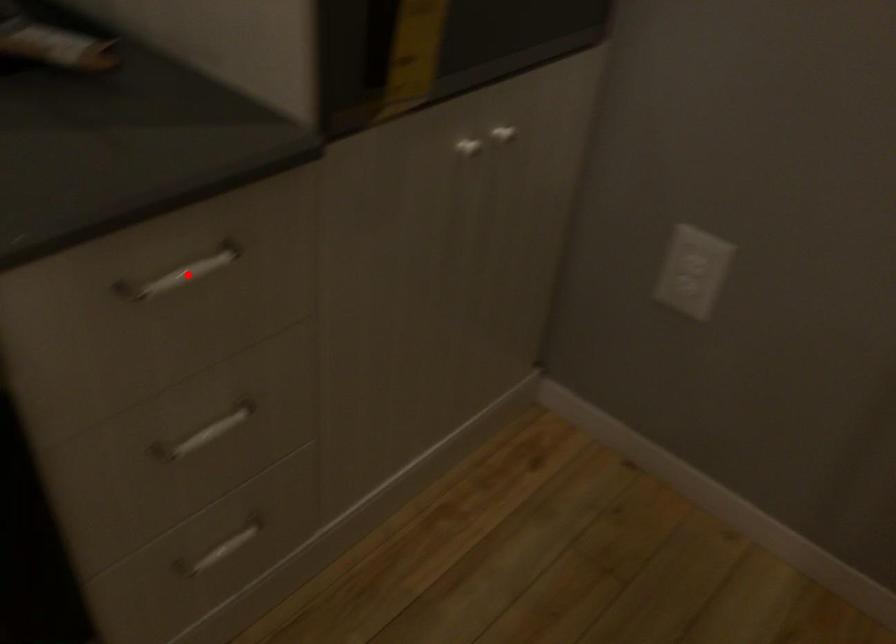
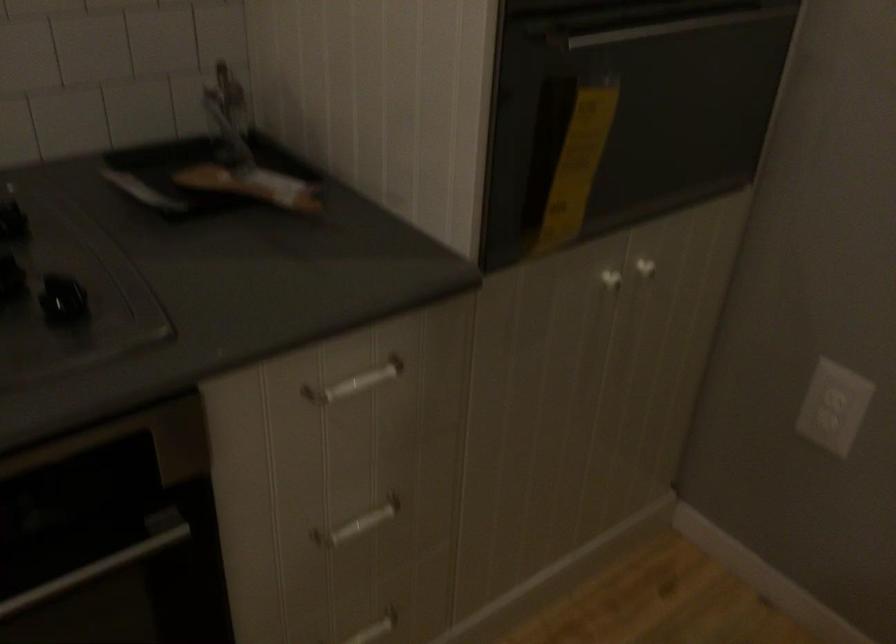
Locate, in the second image, the point that corresponds to the highlighted location in the first image.

(355, 383)